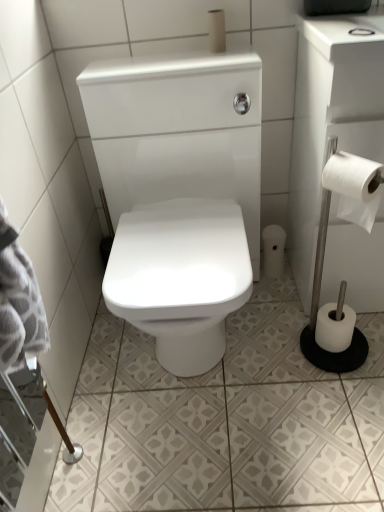
Identify the location of free space to the right of white paper roll at lower right, the 3th toilet paper in the right-to-left sequence. (290, 270).